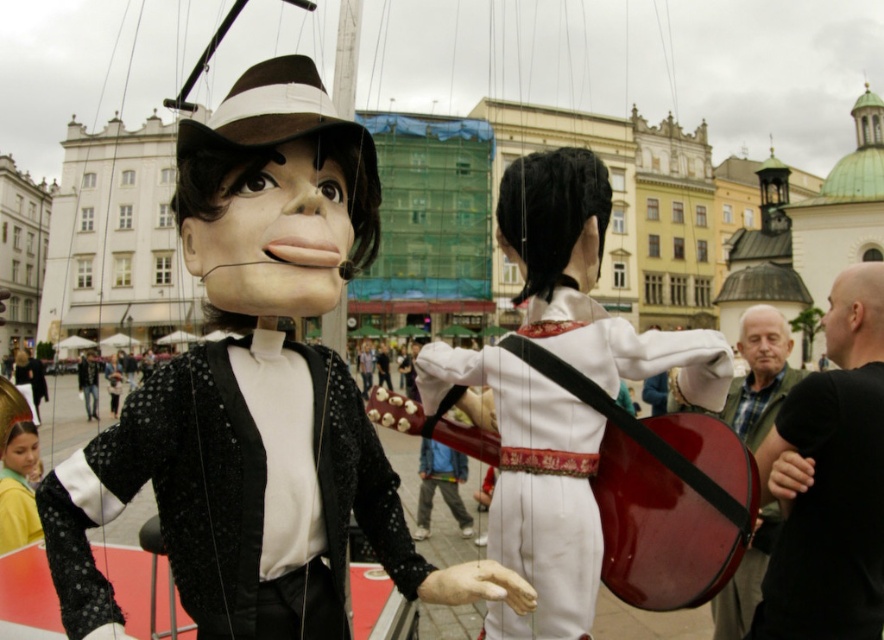
Who is higher up, black leather jacket at upper right or green plaid shirt at right?

green plaid shirt at right is above.

Is black leather jacket at upper right taller than green plaid shirt at right?

Correct, black leather jacket at upper right is much taller as green plaid shirt at right.

Which is in front, point (846, 477) or point (744, 435)?

Positioned in front is point (846, 477).

Where is `black leather jacket at upper right`? The width and height of the screenshot is (884, 640). black leather jacket at upper right is located at coordinates (829, 481).

Can you confirm if black sequined jacket at center is shorter than white matte guitar at center?

Yes, black sequined jacket at center is shorter than white matte guitar at center.

Is black sequined jacket at center wider than white matte guitar at center?

Correct, the width of black sequined jacket at center exceeds that of white matte guitar at center.

Describe the element at coordinates (168, 497) in the screenshot. The image size is (884, 640). I see `black sequined jacket at center` at that location.

At what (x,y) coordinates should I click in order to perform the action: click on black sequined jacket at center. Please return your answer as a coordinate pair (x, y). Image resolution: width=884 pixels, height=640 pixels. Looking at the image, I should click on (168, 497).

Is white matte guitar at center smaller than green plaid shirt at right?

Correct, white matte guitar at center occupies less space than green plaid shirt at right.

From the picture: Between white matte guitar at center and green plaid shirt at right, which one has less height?

Standing shorter between the two is white matte guitar at center.

Which is behind, point (444, 349) or point (766, 392)?

Point (766, 392)

At what (x,y) coordinates should I click in order to perform the action: click on white matte guitar at center. Please return your answer as a coordinate pair (x, y). Image resolution: width=884 pixels, height=640 pixels. Looking at the image, I should click on [532, 486].